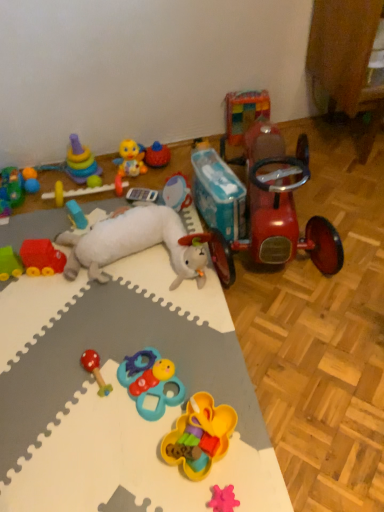
Question: Could you tell me if rubberized yellow flower-shaped toy at center, the 4th toy from the right, is facing yellow rubber duck at upper center, which is counted as the eighth toy, starting from the right?

Choices:
 (A) yes
 (B) no

Answer: (B)

Question: Is there a large distance between rubberized yellow flower-shaped toy at center, the 4th toy from the right, and yellow rubber duck at upper center, arranged as the sixth toy when viewed from the left?

Choices:
 (A) no
 (B) yes

Answer: (B)

Question: Is rubberized yellow flower-shaped toy at center, the 4th toy from the right, further to the viewer compared to yellow rubber duck at upper center, arranged as the sixth toy when viewed from the left?

Choices:
 (A) yes
 (B) no

Answer: (B)

Question: Is rubberized yellow flower-shaped toy at center, the 4th toy from the right, placed right next to yellow rubber duck at upper center, arranged as the sixth toy when viewed from the left?

Choices:
 (A) no
 (B) yes

Answer: (A)

Question: Can you confirm if rubberized yellow flower-shaped toy at center, the tenth toy in the left-to-right sequence, is positioned to the right of yellow rubber duck at upper center, which is counted as the eighth toy, starting from the right?

Choices:
 (A) no
 (B) yes

Answer: (B)

Question: Is rubberized yellow flower-shaped toy at center, the tenth toy in the left-to-right sequence, spatially inside rubber car at left, which is the thirteenth toy in right-to-left order, or outside of it?

Choices:
 (A) outside
 (B) inside

Answer: (A)

Question: Based on their positions, is rubberized yellow flower-shaped toy at center, the 4th toy from the right, located to the left or right of rubber car at left, which is the thirteenth toy in right-to-left order?

Choices:
 (A) left
 (B) right

Answer: (B)

Question: In terms of size, does rubberized yellow flower-shaped toy at center, the 4th toy from the right, appear bigger or smaller than rubber car at left, which is the thirteenth toy in right-to-left order?

Choices:
 (A) small
 (B) big

Answer: (B)

Question: In terms of width, does rubberized yellow flower-shaped toy at center, the 4th toy from the right, look wider or thinner when compared to rubber car at left, placed as the 1th toy when sorted from left to right?

Choices:
 (A) wide
 (B) thin

Answer: (A)

Question: Is point (185, 188) positioned closer to the camera than point (14, 187)?

Choices:
 (A) farther
 (B) closer

Answer: (A)

Question: Would you say plastic drum at center, the ninth toy from the left, is inside or outside rubber car at left, placed as the 1th toy when sorted from left to right?

Choices:
 (A) inside
 (B) outside

Answer: (B)

Question: From the image's perspective, is plastic drum at center, the fifth toy when ordered from right to left, positioned above or below rubber car at left, placed as the 1th toy when sorted from left to right?

Choices:
 (A) above
 (B) below

Answer: (B)

Question: From a real-world perspective, is plastic drum at center, the fifth toy when ordered from right to left, positioned above or below rubber car at left, placed as the 1th toy when sorted from left to right?

Choices:
 (A) above
 (B) below

Answer: (A)

Question: Looking at their shapes, would you say multicolored plastic rings at upper left, marked as the 2th toy in a left-to-right arrangement, is wider or thinner than pink rubber bear at lower center, which is the 11th toy in left-to-right order?

Choices:
 (A) thin
 (B) wide

Answer: (B)

Question: Choose the correct answer: Is multicolored plastic rings at upper left, marked as the 2th toy in a left-to-right arrangement, inside pink rubber bear at lower center, which is the 11th toy in left-to-right order, or outside it?

Choices:
 (A) inside
 (B) outside

Answer: (B)